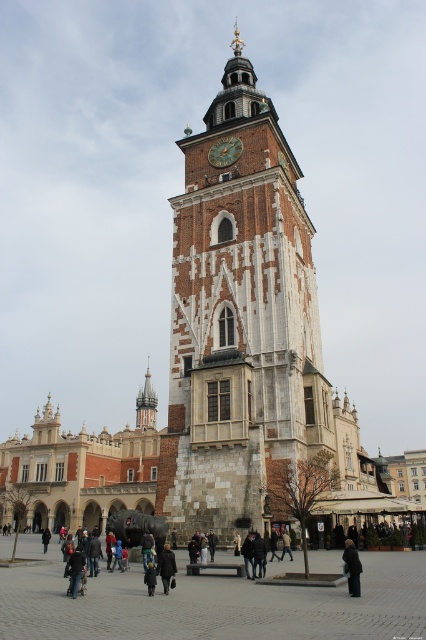
You are standing in the historic square and see the tall ornate tower with a clock face at its center. There is a point marked at coordinates (215, 605) which is on the brick pavement at center. If you walk straight towards the tower from this point, will you be walking towards the center of the square?

The point marked at coordinates (215, 605) is located at the brick pavement at center. Therefore, walking straight towards the tower from this point means you are already at the center of the square, so you won not be moving towards the center but directly towards the tower itself.